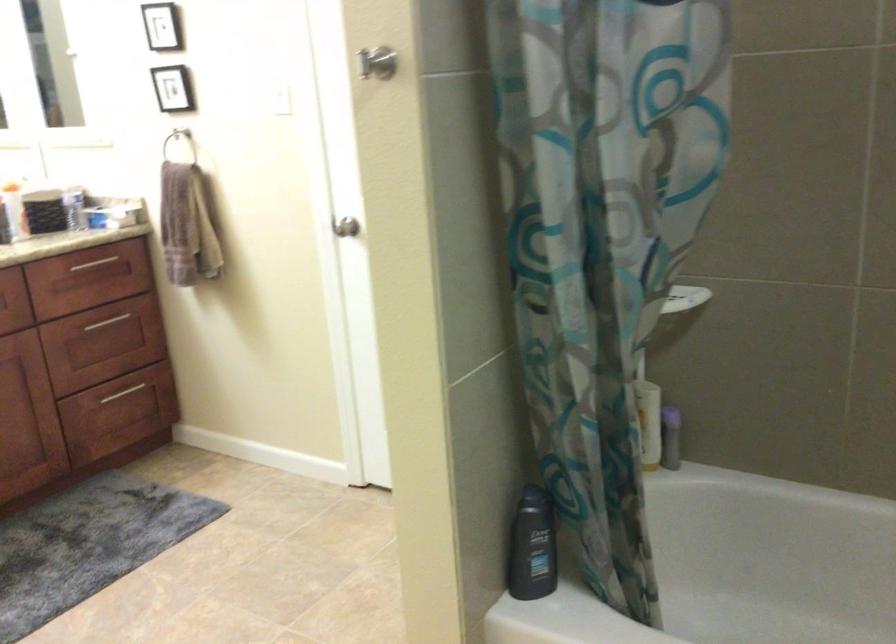
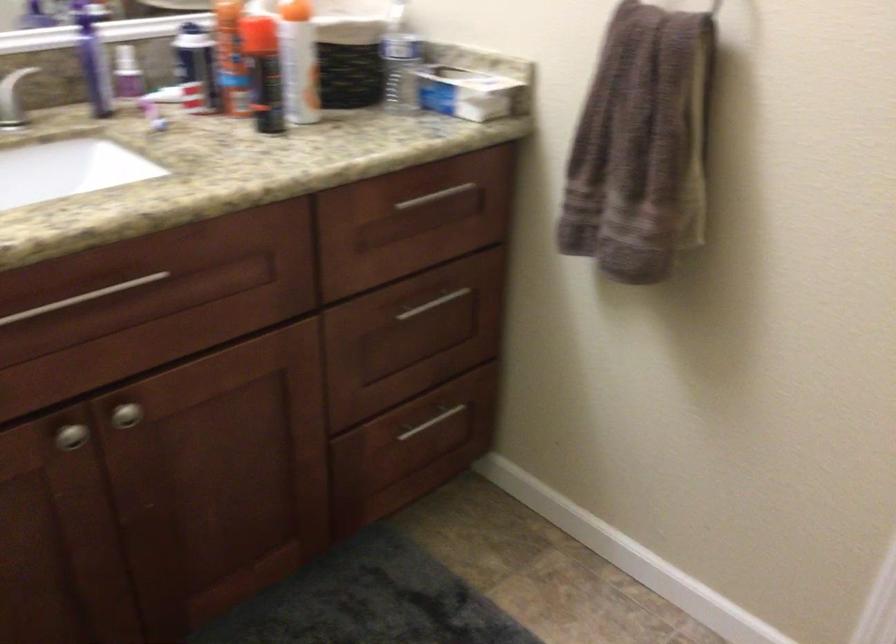
The point at (112, 263) is marked in the first image. Where is the corresponding point in the second image?

(445, 201)